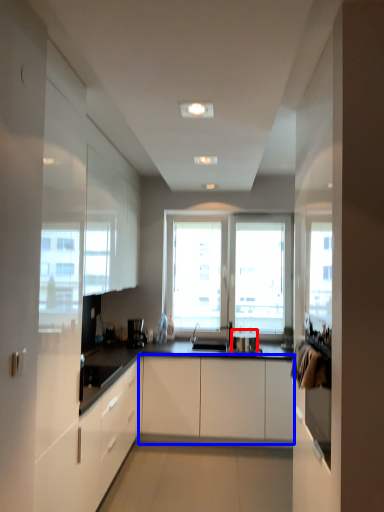
Question: Among these objects, which one is farthest to the camera, appliance (highlighted by a red box) or cabinetry (highlighted by a blue box)?

Choices:
 (A) appliance
 (B) cabinetry

Answer: (A)